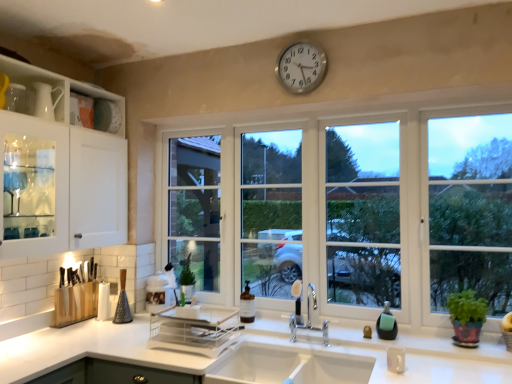
Question: Would you say white ceramic sink at center is part of clear plastic tray at center's contents?

Choices:
 (A) yes
 (B) no

Answer: (B)

Question: Considering the relative sizes of clear plastic tray at center and white ceramic sink at center in the image provided, is clear plastic tray at center shorter than white ceramic sink at center?

Choices:
 (A) yes
 (B) no

Answer: (A)

Question: Is the depth of clear plastic tray at center greater than that of white ceramic sink at center?

Choices:
 (A) yes
 (B) no

Answer: (A)

Question: Is clear plastic tray at center with white ceramic sink at center?

Choices:
 (A) no
 (B) yes

Answer: (A)

Question: Is clear plastic tray at center looking in the opposite direction of white ceramic sink at center?

Choices:
 (A) no
 (B) yes

Answer: (A)

Question: From the image's perspective, is green leafy plant in pot at right positioned above or below clear plastic tray at center?

Choices:
 (A) below
 (B) above

Answer: (B)

Question: From a real-world perspective, is green leafy plant in pot at right positioned above or below clear plastic tray at center?

Choices:
 (A) below
 (B) above

Answer: (B)

Question: Considering the positions of green leafy plant in pot at right and clear plastic tray at center in the image, is green leafy plant in pot at right wider or thinner than clear plastic tray at center?

Choices:
 (A) wide
 (B) thin

Answer: (B)

Question: Is point (464, 322) positioned closer to the camera than point (154, 332)?

Choices:
 (A) farther
 (B) closer

Answer: (B)

Question: From the image's perspective, is silver metallic clock at upper center above or below clear plastic tray at center?

Choices:
 (A) above
 (B) below

Answer: (A)

Question: Is silver metallic clock at upper center taller or shorter than clear plastic tray at center?

Choices:
 (A) short
 (B) tall

Answer: (B)

Question: Considering the positions of silver metallic clock at upper center and clear plastic tray at center in the image, is silver metallic clock at upper center bigger or smaller than clear plastic tray at center?

Choices:
 (A) big
 (B) small

Answer: (B)

Question: Is silver metallic clock at upper center in front of or behind clear plastic tray at center in the image?

Choices:
 (A) behind
 (B) front

Answer: (A)

Question: Would you say green leafy plant in pot at right is to the left or to the right of white glass window at center in the picture?

Choices:
 (A) left
 (B) right

Answer: (B)

Question: Is green leafy plant in pot at right bigger or smaller than white glass window at center?

Choices:
 (A) big
 (B) small

Answer: (B)